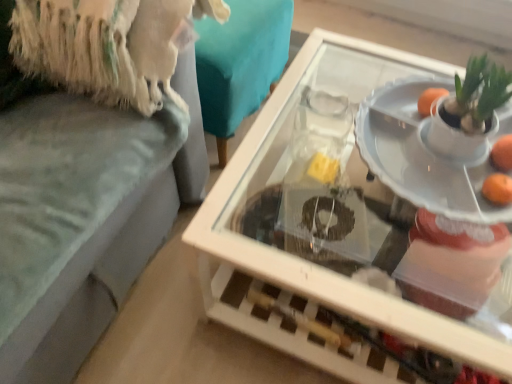
Question: Is the position of orange matte at right, placed as the 2th orange when sorted from back to front, more distant than that of white glossy plate at center?

Choices:
 (A) yes
 (B) no

Answer: (A)

Question: From a real-world perspective, is orange matte at right, the 1th orange positioned from the bottom, physically above white glossy plate at center?

Choices:
 (A) no
 (B) yes

Answer: (B)

Question: Can you confirm if orange matte at right, the 1th orange positioned from the bottom, is thinner than white glossy plate at center?

Choices:
 (A) yes
 (B) no

Answer: (A)

Question: Is orange matte at right, which appears as the first orange when viewed from the front, not within white glossy plate at center?

Choices:
 (A) no
 (B) yes

Answer: (A)

Question: Is orange matte at right, which appears as the first orange when viewed from the front, at the right side of white glossy plate at center?

Choices:
 (A) yes
 (B) no

Answer: (A)

Question: Is white glossy plate at center at the back of orange matte at right, the 1th orange positioned from the bottom?

Choices:
 (A) yes
 (B) no

Answer: (A)

Question: From a real-world perspective, does white glossy plate at center sit lower than orange matte at right, the 1th orange positioned from the bottom?

Choices:
 (A) yes
 (B) no

Answer: (A)

Question: Does white glossy plate at center have a greater height compared to orange matte at right, which appears as the first orange when viewed from the front?

Choices:
 (A) no
 (B) yes

Answer: (B)

Question: Is white glossy plate at center smaller than orange matte at right, the 1th orange positioned from the bottom?

Choices:
 (A) no
 (B) yes

Answer: (A)

Question: Considering the relative positions of white glossy plate at center and orange matte at right, placed as the 2th orange when sorted from back to front, in the image provided, is white glossy plate at center to the right of orange matte at right, placed as the 2th orange when sorted from back to front, from the viewer's perspective?

Choices:
 (A) yes
 (B) no

Answer: (B)

Question: Can you confirm if white glossy plate at center is thinner than orange matte at right, the 1th orange positioned from the bottom?

Choices:
 (A) no
 (B) yes

Answer: (A)

Question: Is white glossy plate at center wider than orange matte at right, which appears as the first orange when viewed from the front?

Choices:
 (A) no
 (B) yes

Answer: (B)

Question: Does orange matte at right, which appears as the first orange when viewed from the front, lie in front of transparent glass table at center?

Choices:
 (A) no
 (B) yes

Answer: (A)